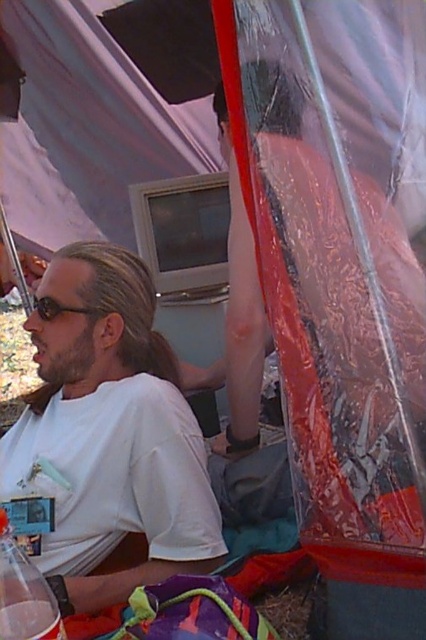
You are standing in the tent and want to grab the clear plastic cup at lower left without touching the white matte shirt at center. Is this possible?

The white matte shirt at center is further to the viewer than the clear plastic cup at lower left, so you can reach the clear plastic cup at lower left without touching the white matte shirt at center by moving around it.

You are organizing a camping gear inventory. You have a storage box that can only fit items smaller than the white matte shirt at center. Can the clear plastic cup at lower left be placed in the box?

The white matte shirt at center is bigger than the clear plastic cup at lower left, so the clear plastic cup at lower left is smaller and can be placed in the box.